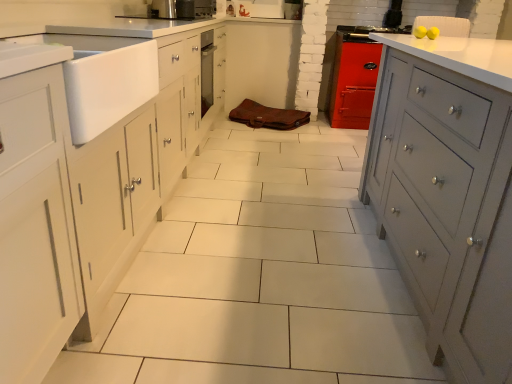
The image size is (512, 384). I want to click on metallic stainless steel oven at center, so click(x=182, y=9).

In order to face white matte sink at left, should I rotate leftwards or rightwards?

You should rotate left by 24.674 degrees.

Describe the element at coordinates (106, 80) in the screenshot. I see `white matte sink at left` at that location.

The height and width of the screenshot is (384, 512). What do you see at coordinates (448, 192) in the screenshot?
I see `matte gray cabinet at right` at bounding box center [448, 192].

Image resolution: width=512 pixels, height=384 pixels. I want to click on metallic stainless steel oven at center, so click(182, 9).

Is the position of white matte sink at left less distant than that of matte gray cabinet at right?

No, white matte sink at left is further to the viewer.

Locate an element on the screen. sink on the left of the matte gray cabinet at right is located at coordinates (106, 80).

Is white matte sink at left not near matte gray cabinet at right?

Indeed, white matte sink at left is not near matte gray cabinet at right.

From a real-world perspective, which object rests below the other?

matte gray cabinet at right, from a real-world perspective.

Which object is further away from the camera, white matte sink at left or metallic stainless steel oven at center?

metallic stainless steel oven at center is behind.

From the image's perspective, is white matte sink at left located above or below metallic stainless steel oven at center?

Based on their image positions, white matte sink at left is located beneath metallic stainless steel oven at center.

Which of these two, white matte sink at left or metallic stainless steel oven at center, is bigger?

white matte sink at left.

Is white matte sink at left positioned with its back to metallic stainless steel oven at center?

No, white matte sink at left's orientation is not away from metallic stainless steel oven at center.

From a real-world perspective, which object rests below the other?

matte gray cabinet at right, from a real-world perspective.

In the image, is metallic stainless steel oven at center on the left side or the right side of matte gray cabinet at right?

From the image, it's evident that metallic stainless steel oven at center is to the left of matte gray cabinet at right.

Is metallic stainless steel oven at center facing away from matte gray cabinet at right?

metallic stainless steel oven at center does not have its back to matte gray cabinet at right.

How far apart are metallic stainless steel oven at center and matte gray cabinet at right?

A distance of 5.18 feet exists between metallic stainless steel oven at center and matte gray cabinet at right.

Based on their sizes in the image, would you say metallic stainless steel oven at center is bigger or smaller than white matte sink at left?

Clearly, metallic stainless steel oven at center is smaller in size than white matte sink at left.

Is metallic stainless steel oven at center positioned before white matte sink at left?

No, it is not.

Who is shorter, metallic stainless steel oven at center or white matte sink at left?

metallic stainless steel oven at center.

Based on the photo, is metallic stainless steel oven at center next to white matte sink at left?

No, metallic stainless steel oven at center is not making contact with white matte sink at left.

Does matte gray cabinet at right turn towards white matte sink at left?

No.

Is matte gray cabinet at right taller than white matte sink at left?

Yes.

Measure the distance between matte gray cabinet at right and white matte sink at left.

A distance of 1.11 meters exists between matte gray cabinet at right and white matte sink at left.

Is matte gray cabinet at right bigger than white matte sink at left?

Indeed, matte gray cabinet at right has a larger size compared to white matte sink at left.

Find the location of a particular element. file cabinet on the right side of metallic stainless steel oven at center is located at coordinates (448, 192).

From the image's perspective, does matte gray cabinet at right appear higher than metallic stainless steel oven at center?

Incorrect, from the image's perspective, matte gray cabinet at right is lower than metallic stainless steel oven at center.

Considering the relative sizes of matte gray cabinet at right and metallic stainless steel oven at center in the image provided, is matte gray cabinet at right thinner than metallic stainless steel oven at center?

No, matte gray cabinet at right is not thinner than metallic stainless steel oven at center.

Between matte gray cabinet at right and metallic stainless steel oven at center, which one has more height?

Standing taller between the two is matte gray cabinet at right.

Find the location of a particular element. This screenshot has width=512, height=384. file cabinet below the white matte sink at left (from the image's perspective) is located at coordinates (448, 192).

I want to click on sink below the metallic stainless steel oven at center (from a real-world perspective), so click(106, 80).

When comparing their distances from white matte sink at left, does matte gray cabinet at right or metallic stainless steel oven at center seem further?

matte gray cabinet at right lies further to white matte sink at left than the other object.

Based on their spatial positions, is matte gray cabinet at right or white matte sink at left further from metallic stainless steel oven at center?

Based on the image, matte gray cabinet at right appears to be further to metallic stainless steel oven at center.

Estimate the real-world distances between objects in this image. Which object is closer to matte gray cabinet at right, white matte sink at left or metallic stainless steel oven at center?

Among the two, white matte sink at left is located nearer to matte gray cabinet at right.

When comparing their distances from white matte sink at left, does metallic stainless steel oven at center or matte gray cabinet at right seem further?

matte gray cabinet at right is further to white matte sink at left.

Which object lies nearer to the anchor point matte gray cabinet at right, metallic stainless steel oven at center or white matte sink at left?

white matte sink at left is positioned closer to the anchor matte gray cabinet at right.

Based on their spatial positions, is white matte sink at left or matte gray cabinet at right closer to metallic stainless steel oven at center?

The object closer to metallic stainless steel oven at center is white matte sink at left.

Where is `sink located between matte gray cabinet at right and metallic stainless steel oven at center in the depth direction`? sink located between matte gray cabinet at right and metallic stainless steel oven at center in the depth direction is located at coordinates (106, 80).